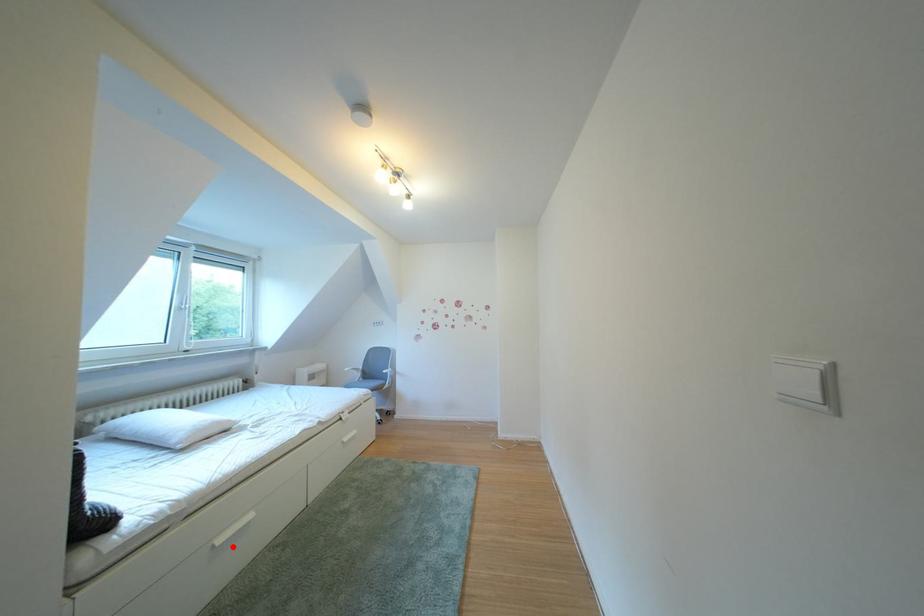
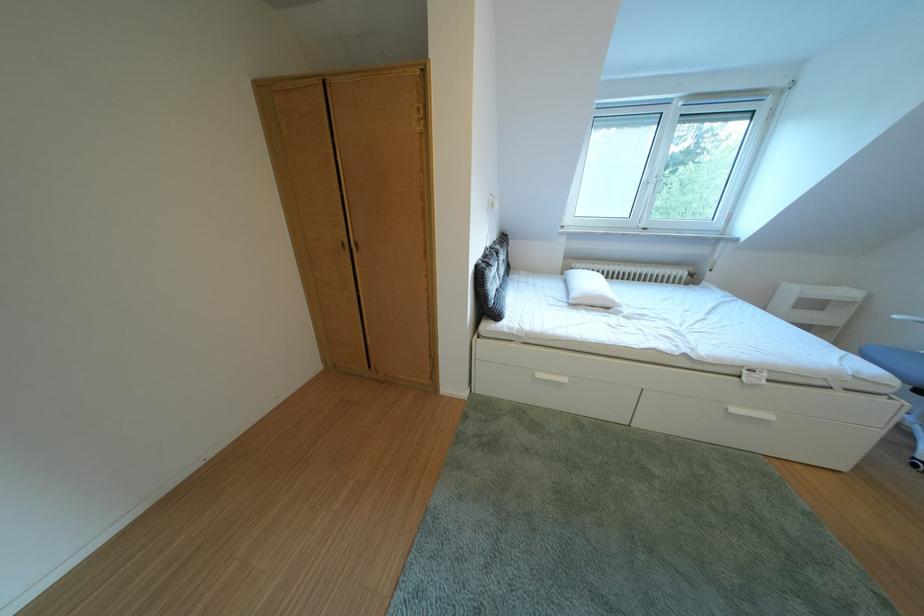
Find the pixel in the second image that matches the highlighted location in the first image.

(553, 381)